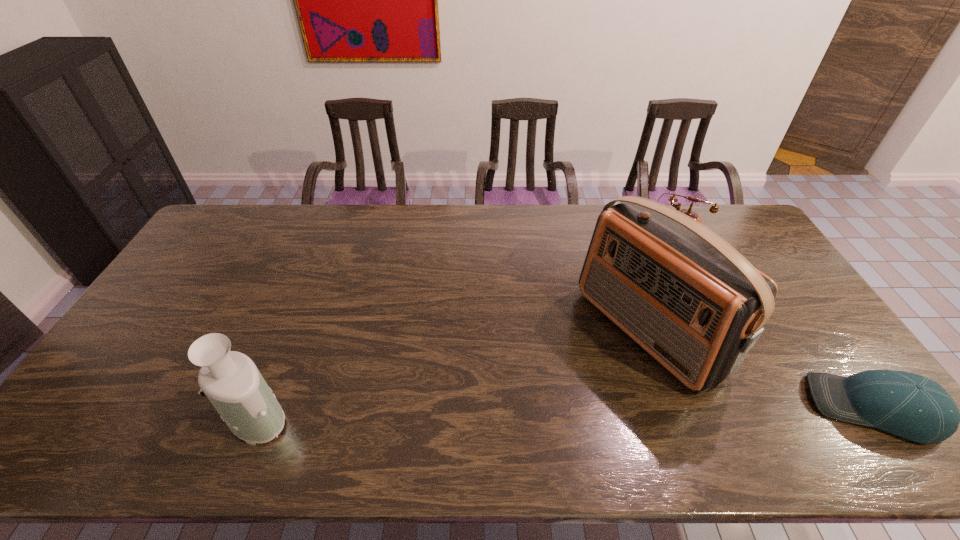
This screenshot has width=960, height=540. I want to click on juicer, so click(231, 381).

At what (x,y) coordinates should I click in order to perform the action: click on the third shortest object. Please return your answer as a coordinate pair (x, y). The height and width of the screenshot is (540, 960). Looking at the image, I should click on (231, 381).

The height and width of the screenshot is (540, 960). I want to click on the third tallest object, so click(714, 208).

Identify the location of the farthest object. (714, 208).

At what (x,y) coordinates should I click in order to perform the action: click on the tallest object. Please return your answer as a coordinate pair (x, y). The width and height of the screenshot is (960, 540). Looking at the image, I should click on (687, 297).

The width and height of the screenshot is (960, 540). What are the coordinates of `vacant space situated 0.280m on the right of the third shortest object` in the screenshot? It's located at (405, 416).

Identify the location of vacant area located 0.130m on the rotary dial of the farthest object. The image size is (960, 540). (639, 262).

The width and height of the screenshot is (960, 540). I want to click on vacant space located 0.400m on the rotary dial of the farthest object, so click(x=621, y=318).

Locate an element on the screen. free location located on the rotary dial of the farthest object is located at coordinates (621, 318).

This screenshot has width=960, height=540. Find the location of `vacant space situated 0.240m on the front-facing side of the tallest object`. vacant space situated 0.240m on the front-facing side of the tallest object is located at coordinates (533, 412).